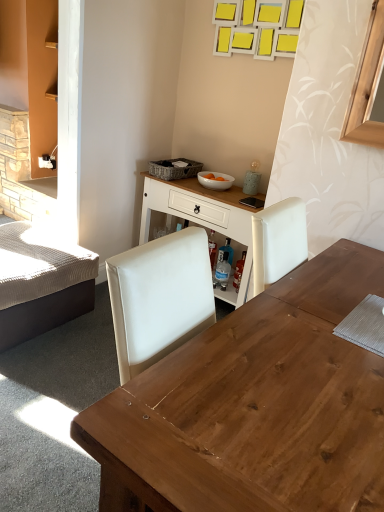
Question: Is textured beige bed at left located within woven gray picnic basket at upper center?

Choices:
 (A) no
 (B) yes

Answer: (A)

Question: Is woven gray picnic basket at upper center bigger than textured beige bed at left?

Choices:
 (A) yes
 (B) no

Answer: (B)

Question: From the image's perspective, is woven gray picnic basket at upper center located above textured beige bed at left?

Choices:
 (A) yes
 (B) no

Answer: (A)

Question: Is woven gray picnic basket at upper center not close to textured beige bed at left?

Choices:
 (A) no
 (B) yes

Answer: (A)

Question: From a real-world perspective, is woven gray picnic basket at upper center beneath textured beige bed at left?

Choices:
 (A) no
 (B) yes

Answer: (A)

Question: In the image, is wooden desk at center positioned in front of or behind woven gray picnic basket at upper center?

Choices:
 (A) behind
 (B) front

Answer: (B)

Question: Is wooden desk at center wider or thinner than woven gray picnic basket at upper center?

Choices:
 (A) wide
 (B) thin

Answer: (A)

Question: In terms of size, does wooden desk at center appear bigger or smaller than woven gray picnic basket at upper center?

Choices:
 (A) small
 (B) big

Answer: (B)

Question: Is wooden desk at center taller or shorter than woven gray picnic basket at upper center?

Choices:
 (A) tall
 (B) short

Answer: (A)

Question: In the image, is white wood table at center on the left side or the right side of textured beige bed at left?

Choices:
 (A) right
 (B) left

Answer: (A)

Question: Does point (205, 215) appear closer or farther from the camera than point (64, 263)?

Choices:
 (A) closer
 (B) farther

Answer: (B)

Question: Considering the positions of white wood table at center and textured beige bed at left in the image, is white wood table at center wider or thinner than textured beige bed at left?

Choices:
 (A) thin
 (B) wide

Answer: (A)

Question: From a real-world perspective, is white wood table at center physically located above or below textured beige bed at left?

Choices:
 (A) below
 (B) above

Answer: (B)

Question: Is woven gray picnic basket at upper center wider or thinner than textured beige bed at left?

Choices:
 (A) thin
 (B) wide

Answer: (A)

Question: Is woven gray picnic basket at upper center bigger or smaller than textured beige bed at left?

Choices:
 (A) small
 (B) big

Answer: (A)